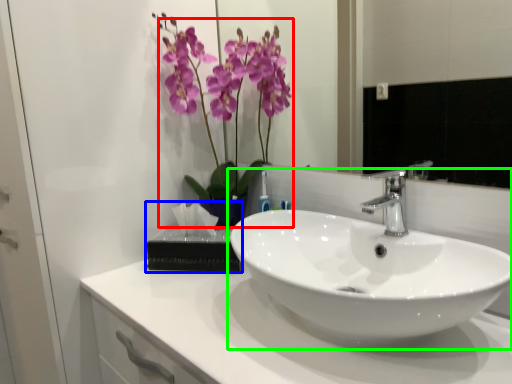
Question: Which is farther away from floral arrangement (highlighted by a red box)? tissue (highlighted by a blue box) or sink (highlighted by a green box)?

Choices:
 (A) tissue
 (B) sink

Answer: (B)